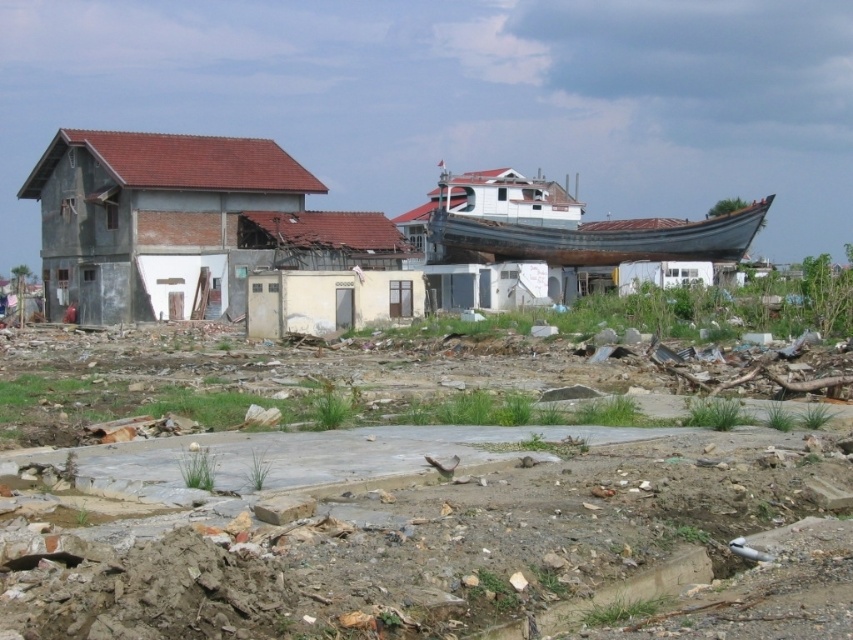
Can you confirm if gray concrete house at left is smaller than rusty metal boat at center?

No, gray concrete house at left is not smaller than rusty metal boat at center.

Image resolution: width=853 pixels, height=640 pixels. Identify the location of gray concrete house at left. (149, 216).